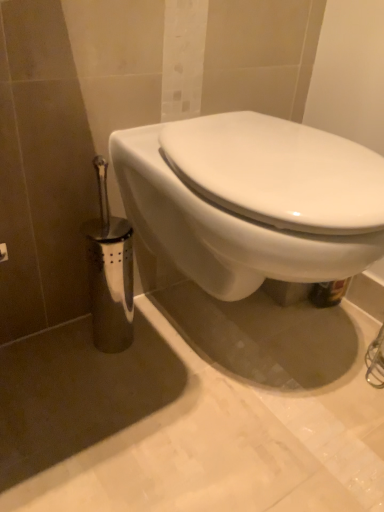
Find the location of a particular element. The image size is (384, 512). free point above white glossy toilet at center (from a real-world perspective) is located at coordinates (274, 141).